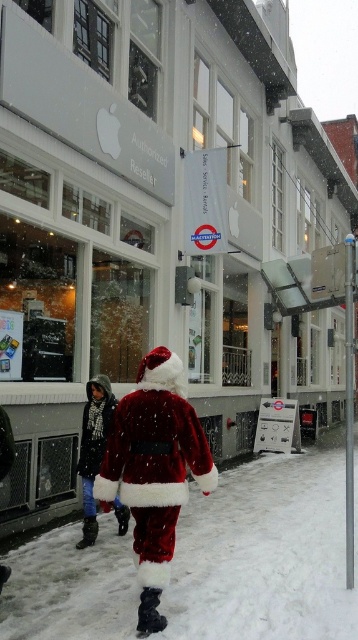
Which is more to the right, white snow at lower center or velvet red santa claus at center?

Positioned to the right is velvet red santa claus at center.

Based on the photo, which of these two, white snow at lower center or velvet red santa claus at center, stands shorter?

white snow at lower center

What are the coordinates of `white snow at lower center` in the screenshot? It's located at (264, 554).

What are the coordinates of `white snow at lower center` in the screenshot? It's located at 264,554.

Who is higher up, velvet red santa claus at center or velvet santa suit at center?

velvet red santa claus at center is higher up.

Is point (176, 417) positioned after point (92, 509)?

No, it is in front of (92, 509).

Locate an element on the screen. velvet red santa claus at center is located at coordinates (153, 470).

Between white snow at lower center and velvet santa suit at center, which one appears on the right side from the viewer's perspective?

velvet santa suit at center

Is point (297, 522) positioned before point (85, 502)?

No, it is behind (85, 502).

The image size is (358, 640). What are the coordinates of `white snow at lower center` in the screenshot? It's located at (264, 554).